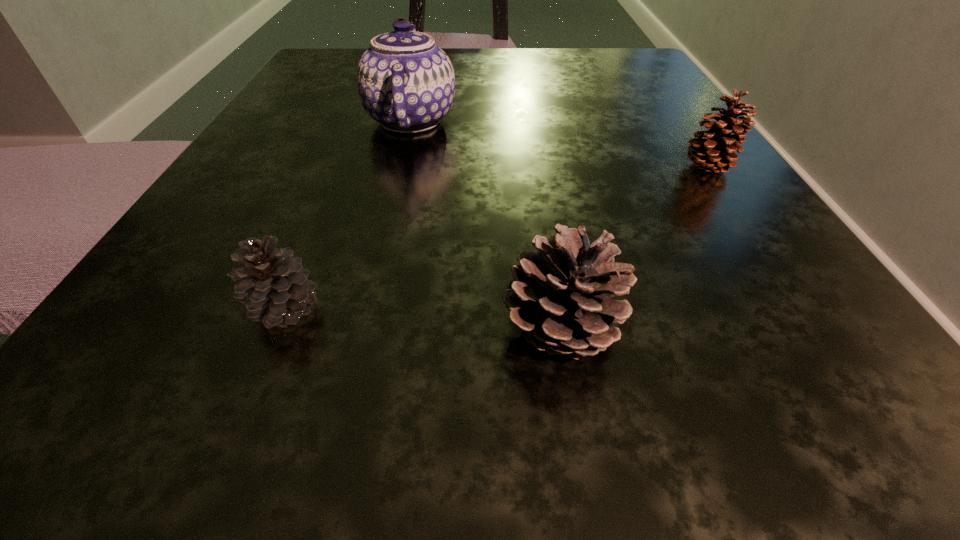
In the image, there is a desktop. Where is `vacant area at the far right corner`? This screenshot has height=540, width=960. vacant area at the far right corner is located at coordinates (632, 62).

Identify the location of unoccupied area between the rightmost pinecone and the second pinecone from left to right. The width and height of the screenshot is (960, 540). (634, 249).

The width and height of the screenshot is (960, 540). Find the location of `blank region between the chinaware and the farthest pinecone`. blank region between the chinaware and the farthest pinecone is located at coordinates (559, 144).

You are a GUI agent. You are given a task and a screenshot of the screen. Output one action in this format:
    pyautogui.click(x=<x>, y=<y>)
    Task: Click on the vacant space that's between the shortest object and the rightmost pinecone
    Image resolution: width=960 pixels, height=540 pixels.
    Given the screenshot: What is the action you would take?
    pyautogui.click(x=496, y=238)

Find the location of `vacant region between the second pinecone from left to right and the shortest object`. vacant region between the second pinecone from left to right and the shortest object is located at coordinates (423, 320).

At what (x,y) coordinates should I click in order to perform the action: click on vacant region between the rightmost object and the tallest object. Please return your answer as a coordinate pair (x, y). This screenshot has width=960, height=540. Looking at the image, I should click on (559, 144).

Identify the location of free spot between the third object from left to right and the tallest object. (486, 226).

Identify the location of vacant space that's between the third object from left to right and the rightmost object. This screenshot has width=960, height=540. (634, 249).

Image resolution: width=960 pixels, height=540 pixels. What are the coordinates of `blank region between the tallest object and the shortest object` in the screenshot? It's located at (348, 215).

Find the location of a particular element. free spot between the tallest object and the shortest object is located at coordinates (348, 215).